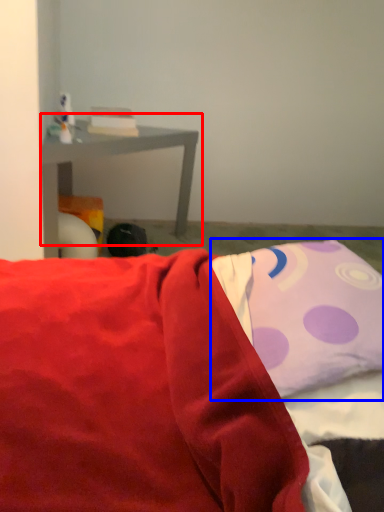
Question: Which of the following is the farthest to the observer, table (highlighted by a red box) or pillow (highlighted by a blue box)?

Choices:
 (A) table
 (B) pillow

Answer: (A)